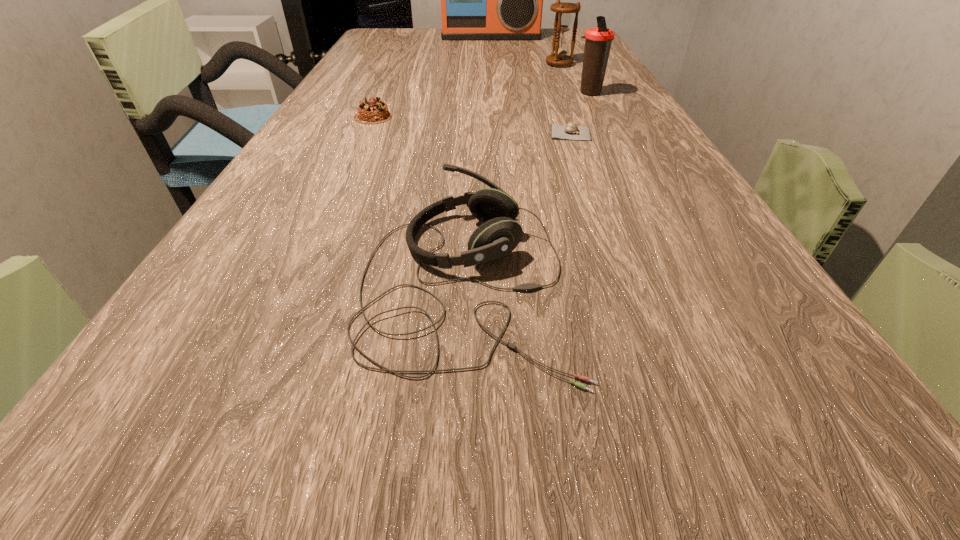
Identify the location of vacant space that satisfies the following two spatial constraints: 1. on the front side of the hourglass; 2. on the left side of the fourth nearest object. (571, 93).

Where is `vacant area in the image that satisfies the following two spatial constraints: 1. on the back side of the thermos bottle; 2. on the left side of the garlic`? This screenshot has height=540, width=960. vacant area in the image that satisfies the following two spatial constraints: 1. on the back side of the thermos bottle; 2. on the left side of the garlic is located at coordinates (557, 93).